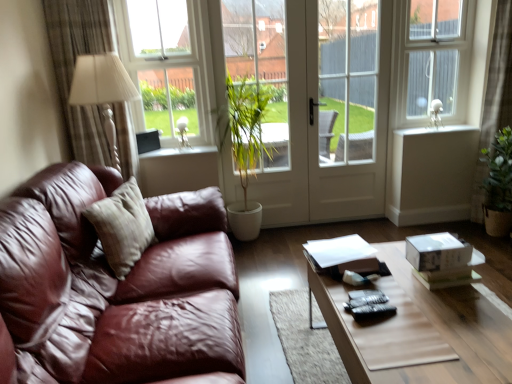
The image size is (512, 384). I want to click on empty space that is ontop of wooden coffee table at center (from a real-world perspective), so click(x=422, y=314).